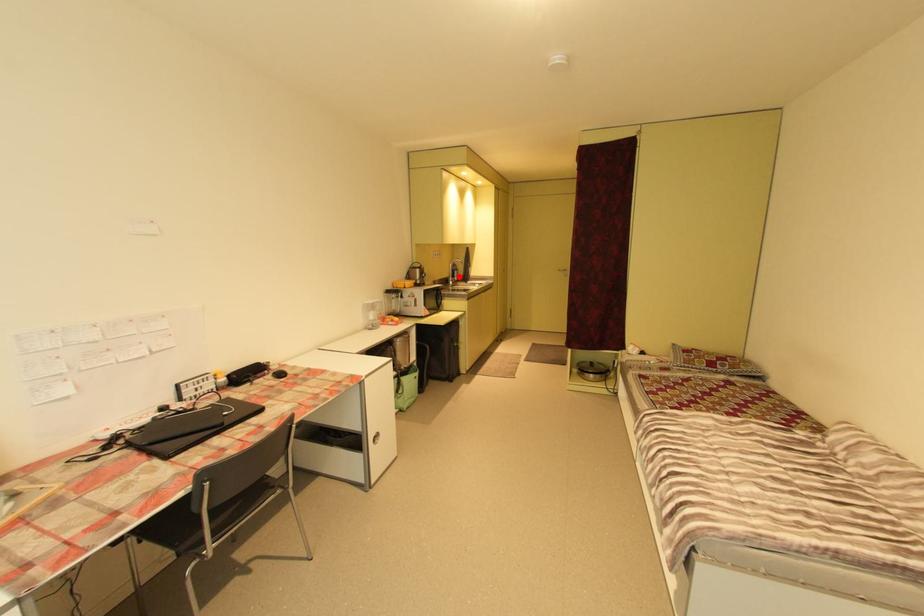
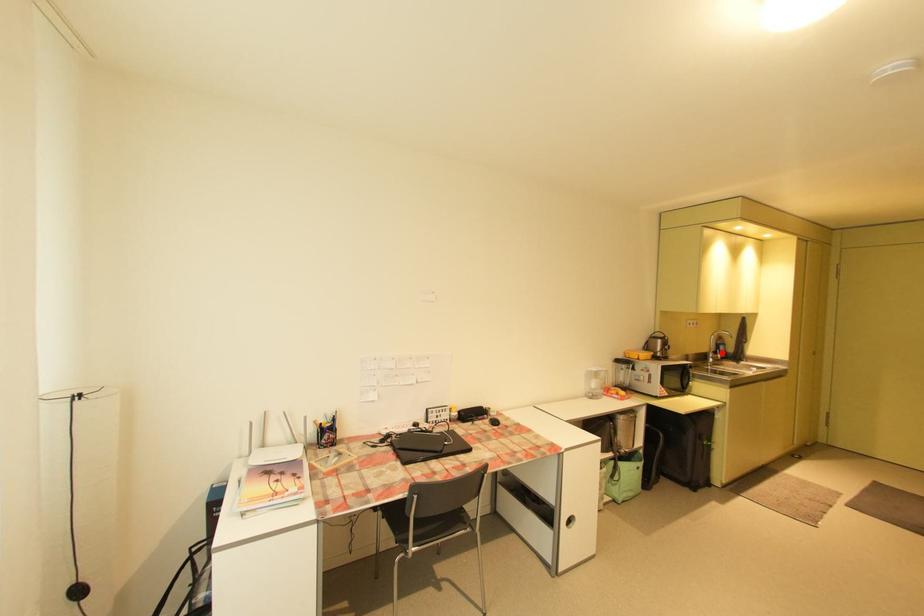
I am providing you with two images of the same scene from different viewpoints. A red point is marked on the first image and another point is marked on the second image. Does the point marked in image1 correspond to the same location as the one in image2?

Yes